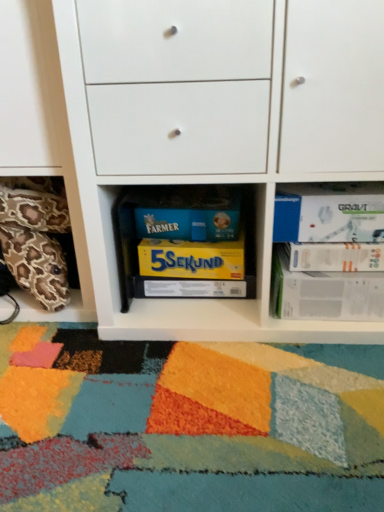
In order to face yellow cardboard box at center, the 5th paperback book positioned from the top, should I rotate leftwards or rightwards?

Rotate your view left by about 0.096°.

This screenshot has height=512, width=384. Describe the element at coordinates (192, 259) in the screenshot. I see `yellow matte board game at center, the third paperback book ordered from the bottom` at that location.

Image resolution: width=384 pixels, height=512 pixels. What do you see at coordinates (335, 256) in the screenshot?
I see `white paper at right, the fourth paperback book from the bottom` at bounding box center [335, 256].

Describe the element at coordinates (75, 251) in the screenshot. This screenshot has height=512, width=384. I see `leopard print pillow at lower left` at that location.

Describe the element at coordinates (328, 214) in the screenshot. This screenshot has width=384, height=512. I see `white matte paperback book at upper right, the first paperback book in the top-to-bottom sequence` at that location.

Locate an element on the screen. Image resolution: width=384 pixels, height=512 pixels. yellow cardboard box at center, the 5th paperback book positioned from the top is located at coordinates (194, 288).

Is yellow cardboard box at center, the 5th paperback book positioned from the top, closer to the viewer compared to yellow matte board game at center, which is counted as the third paperback book, starting from the top?

No, it is not.

Which is closer to the camera, (149, 277) or (166, 253)?

Point (149, 277).

From a real-world perspective, is yellow cardboard box at center, arranged as the 1th paperback book when ordered from the bottom, over yellow matte board game at center, which is counted as the third paperback book, starting from the top?

No.

Is yellow cardboard box at center, arranged as the 1th paperback book when ordered from the bottom, outside of yellow matte board game at center, the third paperback book ordered from the bottom?

Absolutely, yellow cardboard box at center, arranged as the 1th paperback book when ordered from the bottom, is external to yellow matte board game at center, the third paperback book ordered from the bottom.

Which point is more forward, (181, 277) or (339, 260)?

Positioned in front is point (339, 260).

Which of these two, yellow matte board game at center, which is counted as the third paperback book, starting from the top, or white paper at right, the fourth paperback book from the bottom, is thinner?

Thinner between the two is yellow matte board game at center, which is counted as the third paperback book, starting from the top.

Looking at this image, is yellow matte board game at center, which is counted as the third paperback book, starting from the top, in contact with white paper at right, acting as the second paperback book starting from the top?

There is a gap between yellow matte board game at center, which is counted as the third paperback book, starting from the top, and white paper at right, acting as the second paperback book starting from the top.

Between yellow matte board game at center, the third paperback book ordered from the bottom, and white paper at right, the fourth paperback book from the bottom, which one is positioned in front?

white paper at right, the fourth paperback book from the bottom.

What's the angular difference between yellow matte board game at center, the third paperback book ordered from the bottom, and white paper at right, the 2th paperback book in the bottom-to-top sequence,'s facing directions?

yellow matte board game at center, the third paperback book ordered from the bottom, and white paper at right, the 2th paperback book in the bottom-to-top sequence, are facing 1.63 degrees away from each other.

The image size is (384, 512). I want to click on paperback book that is the 1st object directly below the yellow matte board game at center, the third paperback book ordered from the bottom (from a real-world perspective), so click(x=324, y=293).

From a real-world perspective, does yellow matte board game at center, which is counted as the third paperback book, starting from the top, sit lower than white paper at right, the fourth paperback book viewed from the top?

Incorrect, from a real-world perspective, yellow matte board game at center, which is counted as the third paperback book, starting from the top, is higher than white paper at right, the fourth paperback book viewed from the top.

Which object is wider, yellow matte board game at center, the third paperback book ordered from the bottom, or white paper at right, the 2th paperback book in the bottom-to-top sequence?

Wider between the two is white paper at right, the 2th paperback book in the bottom-to-top sequence.

Does point (278, 334) come farther from viewer compared to point (182, 289)?

No, it is not.

Between white matte cabinet at center and yellow cardboard box at center, the 5th paperback book positioned from the top, which one has smaller size?

With smaller size is yellow cardboard box at center, the 5th paperback book positioned from the top.

Is white matte cabinet at center facing away from yellow cardboard box at center, arranged as the 1th paperback book when ordered from the bottom?

white matte cabinet at center is not turned away from yellow cardboard box at center, arranged as the 1th paperback book when ordered from the bottom.

Considering the positions of objects white matte cabinet at center and yellow cardboard box at center, the 5th paperback book positioned from the top, in the image provided, who is more to the left, white matte cabinet at center or yellow cardboard box at center, the 5th paperback book positioned from the top,?

Positioned to the left is yellow cardboard box at center, the 5th paperback book positioned from the top.

Would you say white matte paperback book at upper right, the first paperback book in the top-to-bottom sequence, is inside or outside leopard print pillow at lower left?

white matte paperback book at upper right, the first paperback book in the top-to-bottom sequence, exists outside the volume of leopard print pillow at lower left.

Can you confirm if white matte paperback book at upper right, the first paperback book in the top-to-bottom sequence, is smaller than leopard print pillow at lower left?

Indeed, white matte paperback book at upper right, the first paperback book in the top-to-bottom sequence, has a smaller size compared to leopard print pillow at lower left.

Which point is more forward, (x=301, y=227) or (x=85, y=309)?

The point (x=301, y=227) is in front.

Considering the relative positions of white matte paperback book at upper right, marked as the fifth paperback book in a bottom-to-top arrangement, and leopard print pillow at lower left in the image provided, is white matte paperback book at upper right, marked as the fifth paperback book in a bottom-to-top arrangement, to the right of leopard print pillow at lower left from the viewer's perspective?

Yes, white matte paperback book at upper right, marked as the fifth paperback book in a bottom-to-top arrangement, is to the right of leopard print pillow at lower left.

Which object is further away from the camera taking this photo, white matte paperback book at upper right, the first paperback book in the top-to-bottom sequence, or white paper at right, the fourth paperback book from the bottom?

Positioned behind is white paper at right, the fourth paperback book from the bottom.

From the image's perspective, is white matte paperback book at upper right, the first paperback book in the top-to-bottom sequence, beneath white paper at right, acting as the second paperback book starting from the top?

Incorrect, from the image's perspective, white matte paperback book at upper right, the first paperback book in the top-to-bottom sequence, is higher than white paper at right, acting as the second paperback book starting from the top.

How much distance is there between white matte paperback book at upper right, the first paperback book in the top-to-bottom sequence, and white paper at right, acting as the second paperback book starting from the top?

2.28 inches.

From the picture: Is white matte paperback book at upper right, marked as the fifth paperback book in a bottom-to-top arrangement, to the left or to the right of white paper at right, the fourth paperback book from the bottom, in the image?

Clearly, white matte paperback book at upper right, marked as the fifth paperback book in a bottom-to-top arrangement, is on the left of white paper at right, the fourth paperback book from the bottom, in the image.

From the image's perspective, which is below, yellow matte board game at center, which is counted as the third paperback book, starting from the top, or white matte paperback book at upper right, marked as the fifth paperback book in a bottom-to-top arrangement?

From the image's view, yellow matte board game at center, which is counted as the third paperback book, starting from the top, is below.

Are yellow matte board game at center, which is counted as the third paperback book, starting from the top, and white matte paperback book at upper right, the first paperback book in the top-to-bottom sequence, far apart?

No, yellow matte board game at center, which is counted as the third paperback book, starting from the top, is not far from white matte paperback book at upper right, the first paperback book in the top-to-bottom sequence.

Is yellow matte board game at center, the third paperback book ordered from the bottom, wider or thinner than white matte paperback book at upper right, marked as the fifth paperback book in a bottom-to-top arrangement?

yellow matte board game at center, the third paperback book ordered from the bottom, is thinner than white matte paperback book at upper right, marked as the fifth paperback book in a bottom-to-top arrangement.

Is white matte paperback book at upper right, marked as the fifth paperback book in a bottom-to-top arrangement, inside yellow matte board game at center, the third paperback book ordered from the bottom?

Actually, white matte paperback book at upper right, marked as the fifth paperback book in a bottom-to-top arrangement, is outside yellow matte board game at center, the third paperback book ordered from the bottom.

You are a GUI agent. You are given a task and a screenshot of the screen. Output one action in this format:
    pyautogui.click(x=<x>, y=<y>)
    Task: Click on the 2nd paperback book positioned below the yellow matte board game at center, which is counted as the third paperback book, starting from the top (from the image's perspective)
    This screenshot has height=512, width=384.
    Given the screenshot: What is the action you would take?
    pyautogui.click(x=194, y=288)

At what (x,y) coordinates should I click in order to perform the action: click on the 1st paperback book located beneath the white paper at right, acting as the second paperback book starting from the top (from a real-world perspective). Please return your answer as a coordinate pair (x, y). This screenshot has height=512, width=384. Looking at the image, I should click on (192, 259).

When comparing their distances from yellow cardboard box at center, the 5th paperback book positioned from the top, does white matte cabinet at center or leopard print pillow at lower left seem further?

white matte cabinet at center is positioned further to the anchor yellow cardboard box at center, the 5th paperback book positioned from the top.

From the image, which object appears to be farther from yellow matte board game at center, the third paperback book ordered from the bottom, white paper at right, acting as the second paperback book starting from the top, or leopard print pillow at lower left?

leopard print pillow at lower left.

Considering their positions, is white matte paperback book at upper right, the first paperback book in the top-to-bottom sequence, positioned closer to white paper at right, the 2th paperback book in the bottom-to-top sequence, than leopard print pillow at lower left?

Among the two, white matte paperback book at upper right, the first paperback book in the top-to-bottom sequence, is located nearer to white paper at right, the 2th paperback book in the bottom-to-top sequence.

In the scene shown: Based on their spatial positions, is yellow cardboard box at center, the 5th paperback book positioned from the top, or yellow matte board game at center, which is counted as the third paperback book, starting from the top, closer to white paper at right, the 2th paperback book in the bottom-to-top sequence?

Based on the image, yellow cardboard box at center, the 5th paperback book positioned from the top, appears to be nearer to white paper at right, the 2th paperback book in the bottom-to-top sequence.

Considering their positions, is white matte cabinet at center positioned closer to leopard print pillow at lower left than yellow matte board game at center, the third paperback book ordered from the bottom?

A: white matte cabinet at center is closer to leopard print pillow at lower left.

Estimate the real-world distances between objects in this image. Which object is further from leopard print pillow at lower left, white matte cabinet at center or white paper at right, the fourth paperback book from the bottom?

Based on the image, white paper at right, the fourth paperback book from the bottom, appears to be further to leopard print pillow at lower left.

Estimate the real-world distances between objects in this image. Which object is further from white matte paperback book at upper right, the first paperback book in the top-to-bottom sequence, white paper at right, acting as the second paperback book starting from the top, or yellow matte board game at center, the third paperback book ordered from the bottom?

yellow matte board game at center, the third paperback book ordered from the bottom.

Which object lies nearer to the anchor point white matte paperback book at upper right, the first paperback book in the top-to-bottom sequence, white matte cabinet at center or white paper at right, the 2th paperback book in the bottom-to-top sequence?

white paper at right, the 2th paperback book in the bottom-to-top sequence, is closer to white matte paperback book at upper right, the first paperback book in the top-to-bottom sequence.

Where is `paperback book between yellow cardboard box at center, arranged as the 1th paperback book when ordered from the bottom, and white matte paperback book at upper right, the first paperback book in the top-to-bottom sequence, from left to right`? This screenshot has height=512, width=384. paperback book between yellow cardboard box at center, arranged as the 1th paperback book when ordered from the bottom, and white matte paperback book at upper right, the first paperback book in the top-to-bottom sequence, from left to right is located at coordinates (324, 293).

The image size is (384, 512). I want to click on chest of drawers between leopard print pillow at lower left and white matte paperback book at upper right, marked as the fifth paperback book in a bottom-to-top arrangement, so click(x=205, y=131).

This screenshot has width=384, height=512. I want to click on paperback book located between leopard print pillow at lower left and yellow cardboard box at center, arranged as the 1th paperback book when ordered from the bottom, in the left-right direction, so click(192, 259).

At what (x,y) coordinates should I click in order to perform the action: click on paperback book situated between yellow matte board game at center, the third paperback book ordered from the bottom, and white paper at right, the 2th paperback book in the bottom-to-top sequence, from left to right. Please return your answer as a coordinate pair (x, y). The image size is (384, 512). Looking at the image, I should click on (194, 288).